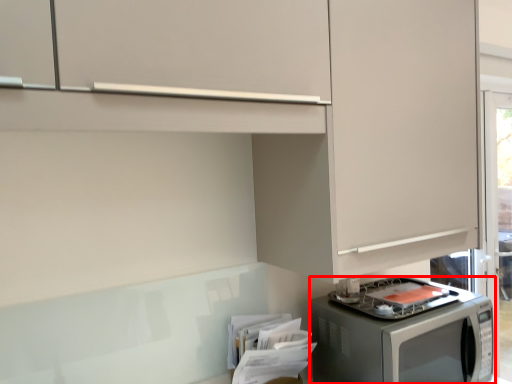
Question: From the image's perspective, what is the correct spatial relationship of home appliance (annotated by the red box) in relation to cabinetry?

Choices:
 (A) above
 (B) below

Answer: (B)